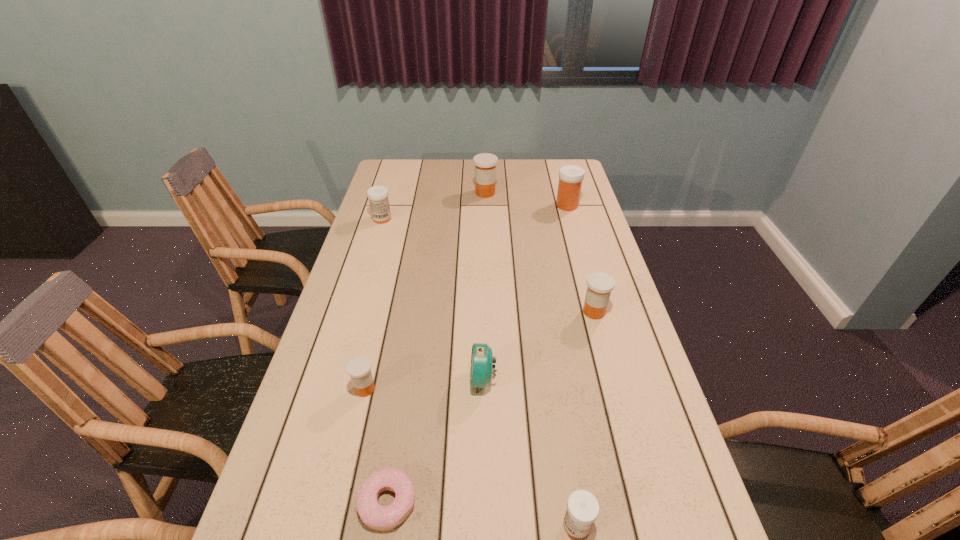
Find the location of a particular element. Image resolution: width=960 pixels, height=540 pixels. the third medicine from left to right is located at coordinates (485, 163).

Where is `the farthest object`? The image size is (960, 540). the farthest object is located at coordinates (485, 163).

You are a GUI agent. You are given a task and a screenshot of the screen. Output one action in this format:
    pyautogui.click(x=<x>, y=<y>)
    Task: Click on the farthest white medicine
    
    Given the screenshot: What is the action you would take?
    pyautogui.click(x=570, y=176)

Locate an element on the screen. The width and height of the screenshot is (960, 540). the biggest white medicine is located at coordinates (570, 176).

Find the location of a particular element. the rightmost orange medicine is located at coordinates (599, 284).

Where is `the fifth nearest object`? This screenshot has width=960, height=540. the fifth nearest object is located at coordinates (599, 284).

Where is `the second nearest white medicine`? the second nearest white medicine is located at coordinates (378, 195).

Locate an element on the screen. the third farthest medicine is located at coordinates (378, 195).

The height and width of the screenshot is (540, 960). Identify the location of alarm clock. (481, 361).

The height and width of the screenshot is (540, 960). Find the location of `the seventh object from right to left`. the seventh object from right to left is located at coordinates (359, 368).